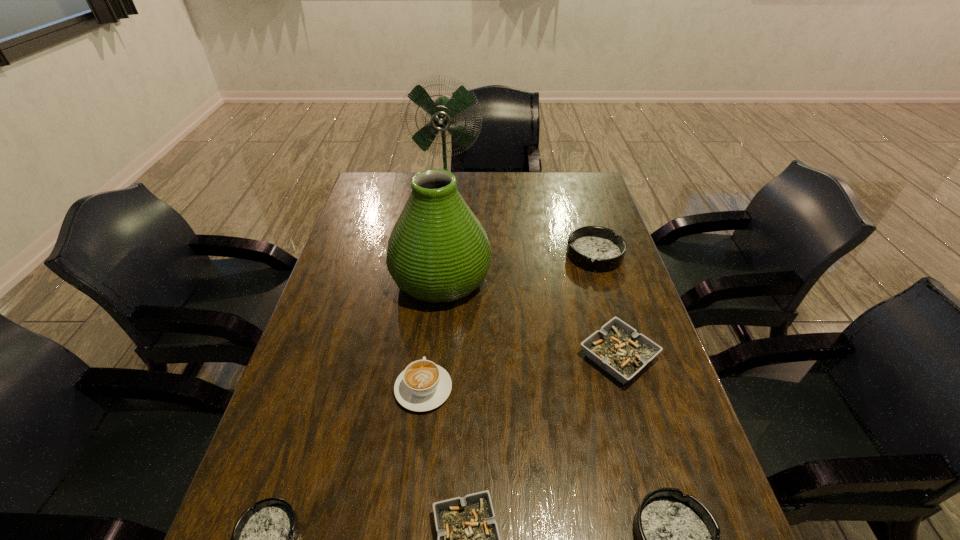
Find the location of a particular element. This screenshot has width=960, height=540. vacant region at the far left corner of the desktop is located at coordinates (383, 190).

At what (x,y) coordinates should I click in order to perform the action: click on free space at the far right corner of the desktop. Please return your answer as a coordinate pair (x, y). This screenshot has width=960, height=540. Looking at the image, I should click on (566, 195).

Find the location of a particular element. The height and width of the screenshot is (540, 960). vacant area that lies between the white cappuccino and the bigger gray ashtray is located at coordinates (520, 373).

At what (x,y) coordinates should I click in order to perform the action: click on vacant space in between the farthest ashtray and the right gray ashtray. Please return your answer as a coordinate pair (x, y). The image size is (960, 540). Looking at the image, I should click on (607, 306).

Image resolution: width=960 pixels, height=540 pixels. What are the coordinates of `free space between the biggest dark ashtray and the second tallest object` in the screenshot? It's located at (517, 266).

At what (x,y) coordinates should I click in order to perform the action: click on vacant space that's between the biggest dark ashtray and the fan. Please return your answer as a coordinate pair (x, y). The image size is (960, 540). Looking at the image, I should click on (520, 223).

Select which object appears as the seventh closest to the green fan. Please provide its 2D coordinates. Your answer should be formatted as a tuple, i.e. [(x, y)], where the tuple contains the x and y coordinates of a point satisfying the conditions above.

[(677, 538)]

Identify which object is the fourth closest to the white cappuccino. Please provide its 2D coordinates. Your answer should be formatted as a tuple, i.e. [(x, y)], where the tuple contains the x and y coordinates of a point satisfying the conditions above.

[(617, 348)]

This screenshot has width=960, height=540. I want to click on ashtray that is the nearest to the left gray ashtray, so click(x=677, y=538).

Locate an element on the screen. The height and width of the screenshot is (540, 960). the third closest ashtray to the right gray ashtray is located at coordinates (468, 538).